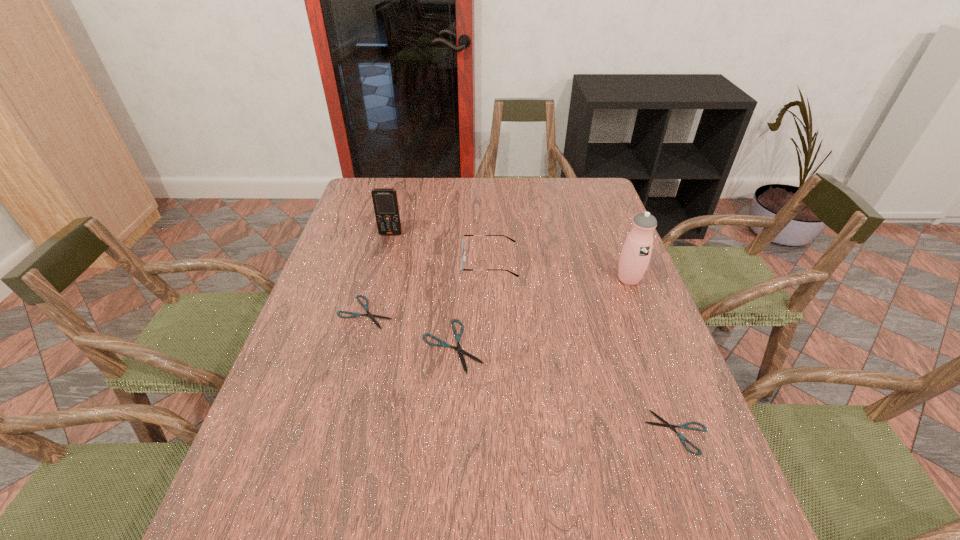
At what (x,y) coordinates should I click in order to perform the action: click on shears present at the right edge. Please return your answer as a coordinate pair (x, y). The width and height of the screenshot is (960, 540). Looking at the image, I should click on (685, 426).

Locate an element on the screen. Image resolution: width=960 pixels, height=540 pixels. thermos bottle that is at the right edge is located at coordinates (636, 252).

Locate an element on the screen. The height and width of the screenshot is (540, 960). object at the near right corner is located at coordinates (685, 426).

Find the location of `blank space at the far edge`. blank space at the far edge is located at coordinates (476, 188).

You are a GUI agent. You are given a task and a screenshot of the screen. Output one action in this format:
    pyautogui.click(x=<x>, y=<y>)
    Task: Click on the vacant area at the near edge
    This screenshot has width=960, height=540.
    Given the screenshot: What is the action you would take?
    pyautogui.click(x=570, y=484)

In the image, there is a desktop. Identify the location of free region at the left edge. This screenshot has width=960, height=540. tap(329, 325).

At what (x,y) coordinates should I click in order to perform the action: click on free region at the right edge of the desktop. Please return your answer as a coordinate pair (x, y). Image resolution: width=960 pixels, height=540 pixels. Looking at the image, I should click on (600, 265).

Where is `free region at the far left corner of the desktop`? free region at the far left corner of the desktop is located at coordinates (399, 193).

Identify the location of vacant space at the far right corner of the desktop. (602, 194).

Locate an element on the screen. free space between the spectacles and the second tallest shears is located at coordinates (428, 287).